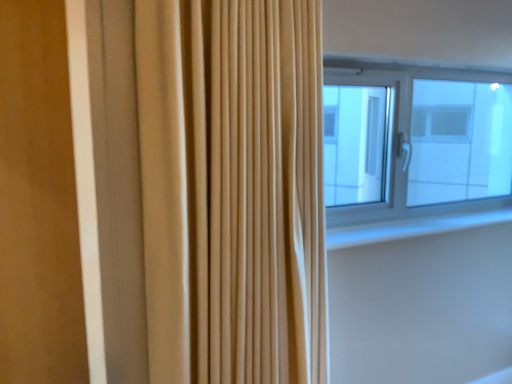
The height and width of the screenshot is (384, 512). What do you see at coordinates (432, 139) in the screenshot?
I see `transparent glass window at upper right` at bounding box center [432, 139].

Find the location of `white smooth window sill at upper right`. white smooth window sill at upper right is located at coordinates (413, 227).

Who is bigger, transparent glass window at upper right or white smooth window sill at upper right?

transparent glass window at upper right.

Is transparent glass window at upper right facing away from white smooth window sill at upper right?

No.

Can you tell me how much transparent glass window at upper right and white smooth window sill at upper right differ in facing direction?

1.19 degrees.

Is transparent glass window at upper right far away from white smooth window sill at upper right?

Yes, transparent glass window at upper right and white smooth window sill at upper right are quite far apart.

Is white smooth window sill at upper right not close to transparent glass window at upper right?

Absolutely, white smooth window sill at upper right is distant from transparent glass window at upper right.

Would you say white smooth window sill at upper right is inside or outside transparent glass window at upper right?

white smooth window sill at upper right lies outside transparent glass window at upper right.

From a real-world perspective, is white smooth window sill at upper right positioned over transparent glass window at upper right based on gravity?

No.

Can you confirm if white smooth window sill at upper right is shorter than transparent glass window at upper right?

Correct, white smooth window sill at upper right is not as tall as transparent glass window at upper right.

Is the surface of beige fabric curtain at center in direct contact with transparent glass window at upper right?

No, beige fabric curtain at center is not in contact with transparent glass window at upper right.

Considering the relative positions of beige fabric curtain at center and transparent glass window at upper right in the image provided, is beige fabric curtain at center behind transparent glass window at upper right?

No, it is not.

Is beige fabric curtain at center aimed at transparent glass window at upper right?

No, beige fabric curtain at center is not oriented towards transparent glass window at upper right.

How distant is beige fabric curtain at center from transparent glass window at upper right?

They are 3.43 meters apart.

Based on their positions, is transparent glass window at upper right located to the left or right of beige fabric curtain at center?

From the image, it's evident that transparent glass window at upper right is to the right of beige fabric curtain at center.

How far apart are transparent glass window at upper right and beige fabric curtain at center?

transparent glass window at upper right and beige fabric curtain at center are 3.43 meters apart from each other.

From the image's perspective, which is below, transparent glass window at upper right or beige fabric curtain at center?

beige fabric curtain at center appears lower in the image.

The width and height of the screenshot is (512, 384). In order to click on window above the beige fabric curtain at center (from a real-world perspective) in this screenshot , I will do `click(432, 139)`.

From a real-world perspective, is beige fabric curtain at center physically below white smooth window sill at upper right?

No, from a real-world perspective, beige fabric curtain at center is not beneath white smooth window sill at upper right.

Is white smooth window sill at upper right located within beige fabric curtain at center?

No, white smooth window sill at upper right is not surrounded by beige fabric curtain at center.

Is beige fabric curtain at center turned away from white smooth window sill at upper right?

No.

From the image's perspective, which one is positioned lower, beige fabric curtain at center or white smooth window sill at upper right?

white smooth window sill at upper right.

Which of these two, white smooth window sill at upper right or beige fabric curtain at center, is smaller?

white smooth window sill at upper right is smaller.

How different are the orientations of white smooth window sill at upper right and beige fabric curtain at center in degrees?

The angular difference between white smooth window sill at upper right and beige fabric curtain at center is 0.286 degrees.

Is beige fabric curtain at center at the back of white smooth window sill at upper right?

No, white smooth window sill at upper right is not facing the opposite direction of beige fabric curtain at center.

Which is more to the left, white smooth window sill at upper right or beige fabric curtain at center?

beige fabric curtain at center is more to the left.

In the image, there is a white smooth window sill at upper right. In order to click on window above it (from the image's perspective) in this screenshot , I will do `click(432, 139)`.

Image resolution: width=512 pixels, height=384 pixels. I want to click on window sill that appears in front of the transparent glass window at upper right, so click(x=413, y=227).

Looking at the image, which one is located further to white smooth window sill at upper right, transparent glass window at upper right or beige fabric curtain at center?

The object further to white smooth window sill at upper right is transparent glass window at upper right.

Which object lies further to the anchor point white smooth window sill at upper right, beige fabric curtain at center or transparent glass window at upper right?

transparent glass window at upper right is further to white smooth window sill at upper right.

Based on their spatial positions, is white smooth window sill at upper right or beige fabric curtain at center closer to transparent glass window at upper right?

white smooth window sill at upper right is positioned closer to the anchor transparent glass window at upper right.

Based on the photo, from the image, which object appears to be nearer to beige fabric curtain at center, white smooth window sill at upper right or transparent glass window at upper right?

white smooth window sill at upper right lies closer to beige fabric curtain at center than the other object.

Consider the image. Looking at the image, which one is located closer to transparent glass window at upper right, beige fabric curtain at center or white smooth window sill at upper right?

white smooth window sill at upper right is closer to transparent glass window at upper right.

Looking at the image, which one is located further to beige fabric curtain at center, transparent glass window at upper right or white smooth window sill at upper right?

transparent glass window at upper right.

Where is `window sill between beige fabric curtain at center and transparent glass window at upper right in the horizontal direction`? window sill between beige fabric curtain at center and transparent glass window at upper right in the horizontal direction is located at coordinates (413, 227).